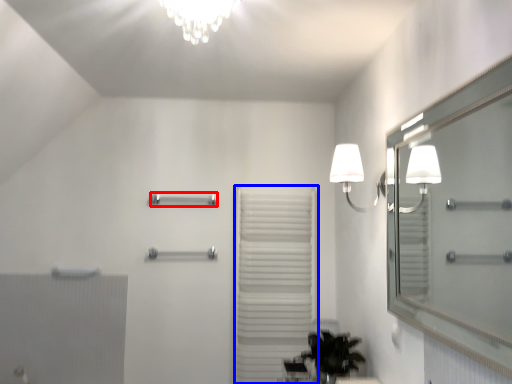
Question: Which of the following is the closest to the observer, towel bar (highlighted by a red box) or curtain (highlighted by a blue box)?

Choices:
 (A) towel bar
 (B) curtain

Answer: (B)